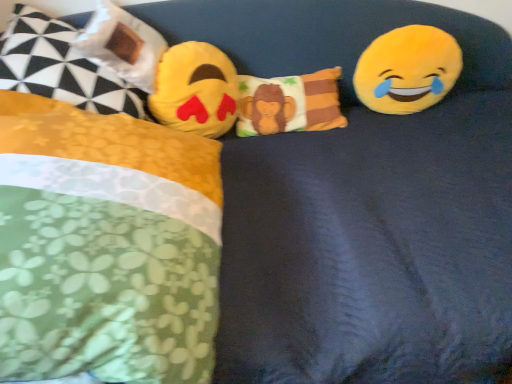
Identify the location of blank space above fluffy cotton monkey pillow at center, which is the first pillow from right to left (from a real-world perspective). This screenshot has width=512, height=384. (285, 82).